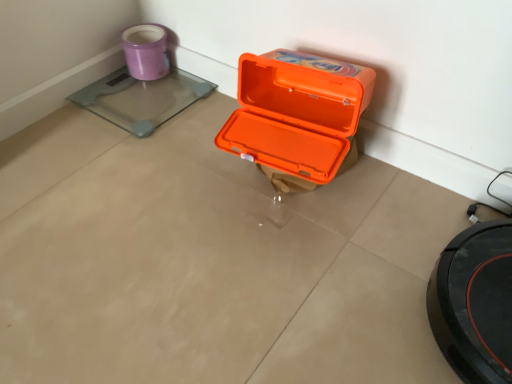
Identify the location of matte purple mug at upper left. The image size is (512, 384). (146, 51).

Is orange plastic box at center in contact with transparent glass scale at upper left?

No.

What's the angular difference between orange plastic box at center and transparent glass scale at upper left's facing directions?

The angle between the facing direction of orange plastic box at center and the facing direction of transparent glass scale at upper left is 7.24 degrees.

From a real-world perspective, is orange plastic box at center positioned under transparent glass scale at upper left based on gravity?

No, from a real-world perspective, orange plastic box at center is not beneath transparent glass scale at upper left.

Is orange plastic box at center oriented away from transparent glass scale at upper left?

No, transparent glass scale at upper left is not at the back of orange plastic box at center.

Which is more to the right, matte purple mug at upper left or transparent glass scale at upper left?

transparent glass scale at upper left is more to the right.

Is matte purple mug at upper left facing towards transparent glass scale at upper left?

Yes, matte purple mug at upper left is facing transparent glass scale at upper left.

Does matte purple mug at upper left have a larger size compared to transparent glass scale at upper left?

Actually, matte purple mug at upper left might be smaller than transparent glass scale at upper left.

Which of these two, transparent glass scale at upper left or orange plastic box at center, stands shorter?

transparent glass scale at upper left is shorter.

From the image's perspective, is transparent glass scale at upper left under orange plastic box at center?

No.

Which object is thinner, transparent glass scale at upper left or orange plastic box at center?

orange plastic box at center.

This screenshot has width=512, height=384. I want to click on box that is above the transparent glass scale at upper left (from a real-world perspective), so click(x=297, y=115).

Considering the relative sizes of orange plastic box at center and matte purple mug at upper left in the image provided, is orange plastic box at center shorter than matte purple mug at upper left?

No.

Is orange plastic box at center smaller than matte purple mug at upper left?

Actually, orange plastic box at center might be larger than matte purple mug at upper left.

Find the location of a particular element. The width and height of the screenshot is (512, 384). box below the matte purple mug at upper left (from the image's perspective) is located at coordinates (297, 115).

From a real-world perspective, is orange plastic box at center physically located above or below matte purple mug at upper left?

In terms of real-world spatial position, orange plastic box at center is above matte purple mug at upper left.

Which of these two, transparent glass scale at upper left or matte purple mug at upper left, stands taller?

Standing taller between the two is matte purple mug at upper left.

Which point is more forward, (x=117, y=117) or (x=131, y=29)?

Positioned in front is point (x=117, y=117).

Is point (160, 44) farther from viewer compared to point (293, 167)?

Yes.

Does matte purple mug at upper left have a larger size compared to orange plastic box at center?

Actually, matte purple mug at upper left might be smaller than orange plastic box at center.

Based on the photo, does matte purple mug at upper left have a lesser height compared to orange plastic box at center?

Yes, matte purple mug at upper left is shorter than orange plastic box at center.

Image resolution: width=512 pixels, height=384 pixels. Find the location of `weight scale above the orange plastic box at center (from the image's perspective)`. weight scale above the orange plastic box at center (from the image's perspective) is located at coordinates (141, 99).

Find the location of a particular element. The width and height of the screenshot is (512, 384). weight scale on the right of matte purple mug at upper left is located at coordinates (141, 99).

Based on their spatial positions, is matte purple mug at upper left or transparent glass scale at upper left further from orange plastic box at center?

Among the two, matte purple mug at upper left is located further to orange plastic box at center.

Considering their positions, is matte purple mug at upper left positioned closer to transparent glass scale at upper left than orange plastic box at center?

Based on the image, matte purple mug at upper left appears to be nearer to transparent glass scale at upper left.

Based on their spatial positions, is orange plastic box at center or transparent glass scale at upper left further from matte purple mug at upper left?

Based on the image, orange plastic box at center appears to be further to matte purple mug at upper left.

From the image, which object appears to be farther from matte purple mug at upper left, transparent glass scale at upper left or orange plastic box at center?

orange plastic box at center is positioned further to the anchor matte purple mug at upper left.

Looking at the image, which one is located closer to transparent glass scale at upper left, orange plastic box at center or matte purple mug at upper left?

Based on the image, matte purple mug at upper left appears to be nearer to transparent glass scale at upper left.

Considering their positions, is transparent glass scale at upper left positioned closer to orange plastic box at center than matte purple mug at upper left?

Among the two, transparent glass scale at upper left is located nearer to orange plastic box at center.

Image resolution: width=512 pixels, height=384 pixels. I want to click on weight scale located between orange plastic box at center and matte purple mug at upper left in the depth direction, so click(x=141, y=99).